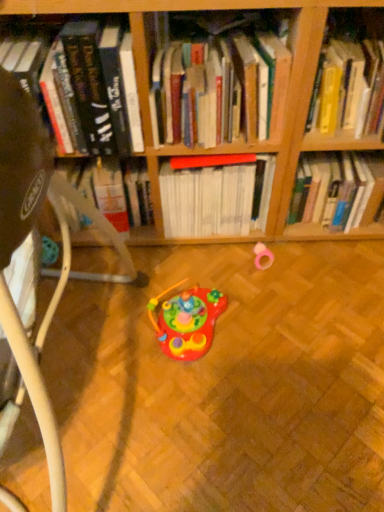
This screenshot has height=512, width=384. Identify the location of vacant area in front of shiny plastic toy at center, which is the first toy in left-to-right order. (198, 410).